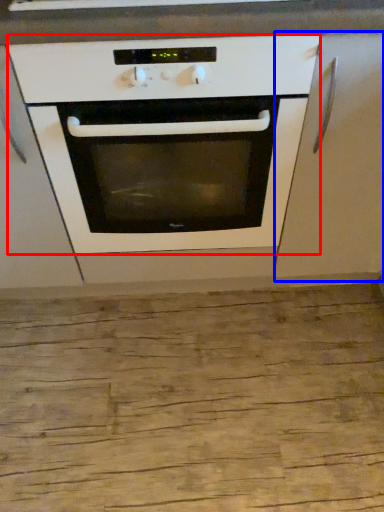
Question: Among these objects, which one is farthest to the camera, oven (highlighted by a red box) or cabinetry (highlighted by a blue box)?

Choices:
 (A) oven
 (B) cabinetry

Answer: (B)